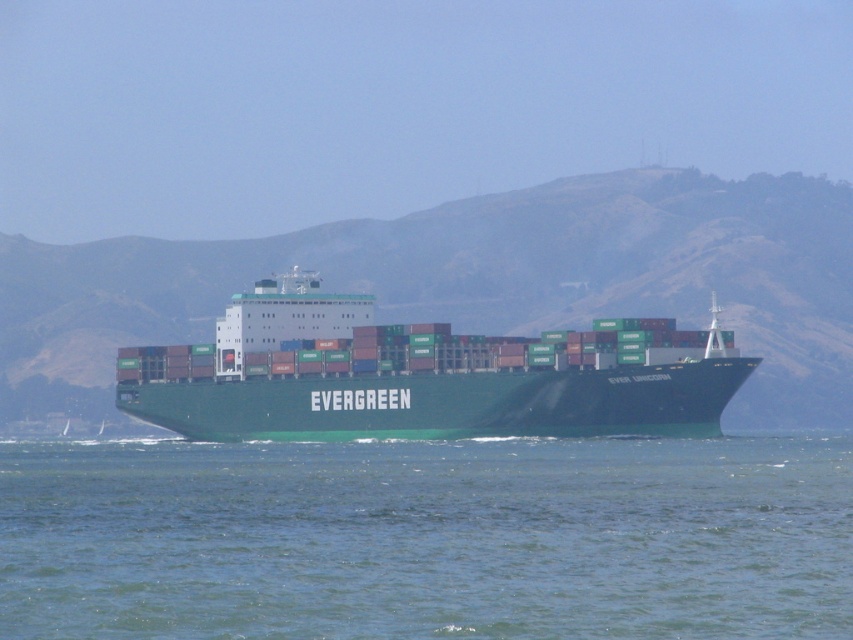
Measure the distance between green water at center and camera.

green water at center is 161.61 feet away from camera.

Is green water at center taller than green matte container ship at center?

Incorrect, green water at center's height is not larger of green matte container ship at center's.

What do you see at coordinates (427, 538) in the screenshot? I see `green water at center` at bounding box center [427, 538].

Where is `green water at center`? green water at center is located at coordinates (427, 538).